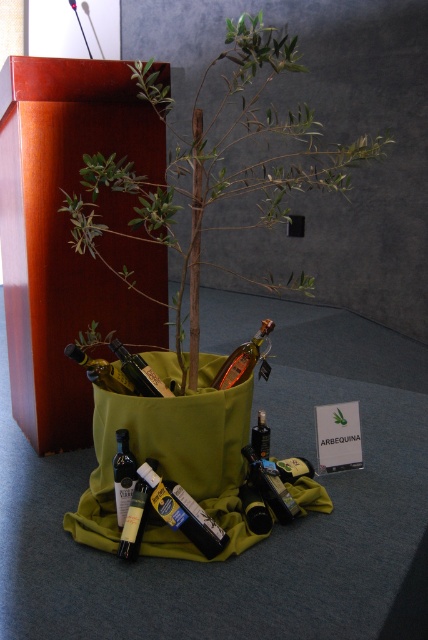
Is point (220, 372) more distant than point (130, 364)?

That is True.

Between translucent amber glass bottle at center and shiny metallic bottle at center, which one appears on the left side from the viewer's perspective?

shiny metallic bottle at center is more to the left.

Where is `translucent amber glass bottle at center`? translucent amber glass bottle at center is located at coordinates (244, 360).

This screenshot has height=640, width=428. What do you see at coordinates (219, 168) in the screenshot?
I see `green fabric bag at center` at bounding box center [219, 168].

Is point (222, 145) closer to camera compared to point (113, 484)?

No, (222, 145) is further to viewer.

The image size is (428, 640). In order to click on green fabric bag at center in this screenshot , I will do `click(219, 168)`.

Who is positioned more to the right, green fabric bag at center or dark green glass bottle at lower center?

green fabric bag at center is more to the right.

Between green fabric bag at center and dark green glass bottle at lower center, which one is positioned higher?

green fabric bag at center

Is point (199, 129) positioned after point (175, 528)?

Yes, it is.

Where is `green fabric bag at center`? The height and width of the screenshot is (640, 428). green fabric bag at center is located at coordinates (219, 168).